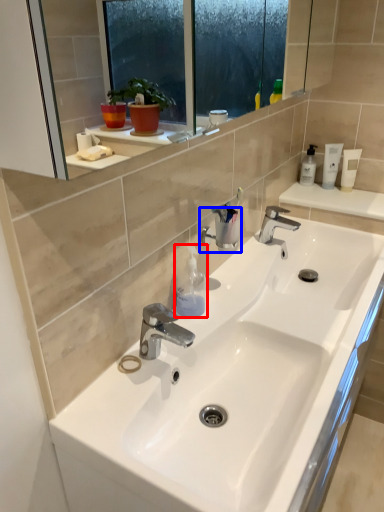
Question: Which point is closer to the camera, toiletry (highlighted by a red box) or plumbing fixture (highlighted by a blue box)?

Choices:
 (A) toiletry
 (B) plumbing fixture

Answer: (A)